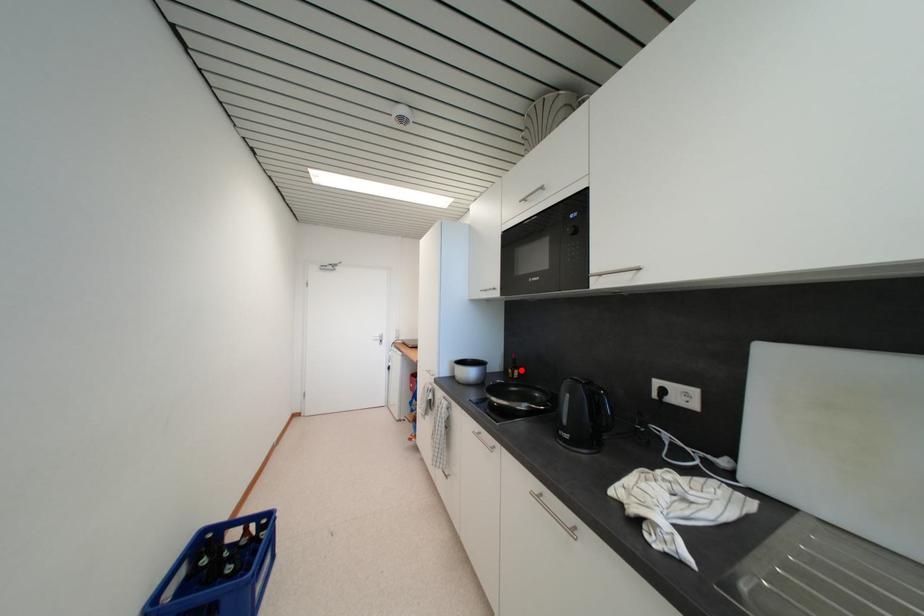
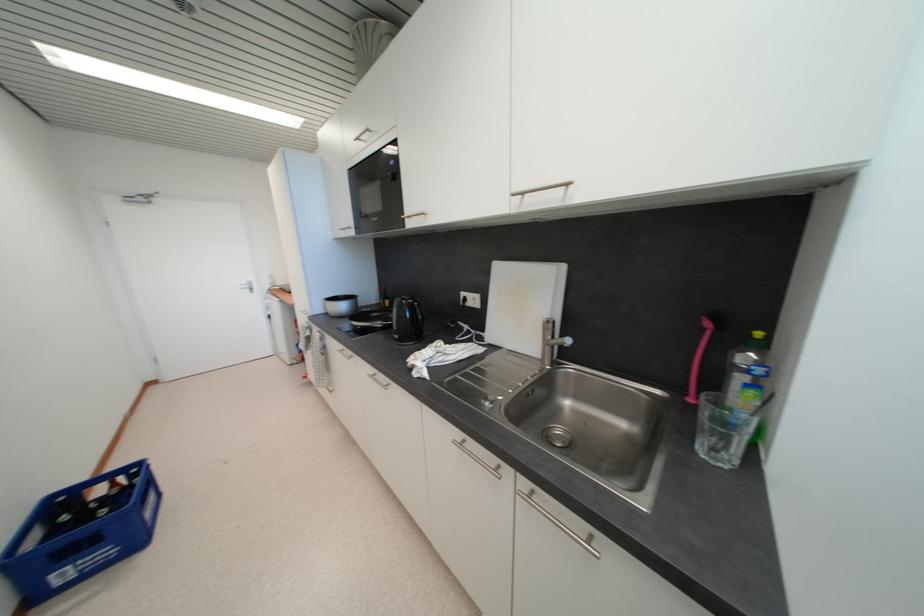
Find the pixel in the second image that matches the highlighted location in the first image.

(392, 301)